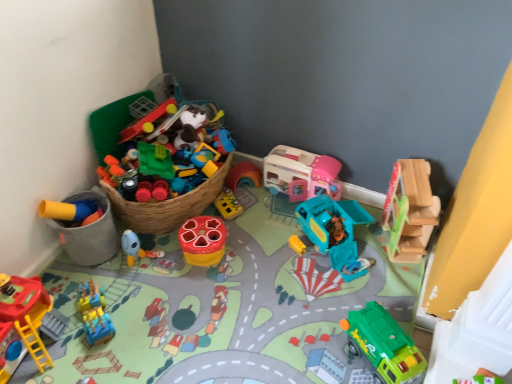
Find the location of a particular element. Image resolution: width=512 pixels, height=384 pixels. free space in front of blue plastic train at lower left, acting as the seventh toy starting from the right is located at coordinates (84, 359).